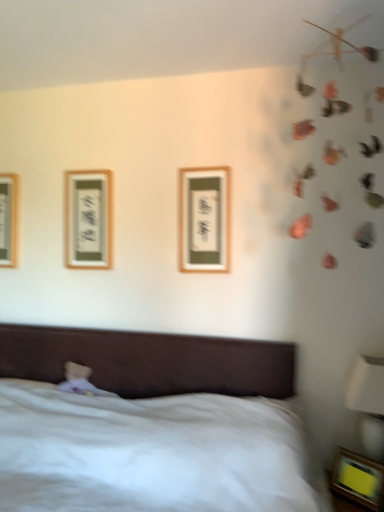
Question: Is wooden framed picture at left, which appears as the 1th picture frame when viewed from the left, to the right of wooden framed picture at center, which appears as the second picture frame when ordered from the bottom, from the viewer's perspective?

Choices:
 (A) yes
 (B) no

Answer: (B)

Question: Is wooden framed picture at left, the 4th picture frame in the front-to-back sequence, taller than wooden framed picture at center, positioned as the 3th picture frame in left-to-right order?

Choices:
 (A) no
 (B) yes

Answer: (B)

Question: Can you confirm if wooden framed picture at left, which appears as the 1th picture frame when viewed from the left, is positioned to the left of wooden framed picture at center, the 3th picture frame in the back-to-front sequence?

Choices:
 (A) yes
 (B) no

Answer: (A)

Question: Is wooden framed picture at left, marked as the fourth picture frame in a bottom-to-top arrangement, bigger than wooden framed picture at center, the third picture frame positioned from the top?

Choices:
 (A) no
 (B) yes

Answer: (A)

Question: Is wooden framed picture at left, marked as the fourth picture frame in a bottom-to-top arrangement, beside wooden framed picture at center, which is the second picture frame in right-to-left order?

Choices:
 (A) no
 (B) yes

Answer: (A)

Question: In the image, is wooden framed picture at center, which appears as the second picture frame when ordered from the bottom, positioned in front of or behind wooden framed picture at left, which appears as the 1th picture frame when viewed from the left?

Choices:
 (A) behind
 (B) front

Answer: (B)

Question: Is wooden framed picture at center, the 3th picture frame in the back-to-front sequence, inside the boundaries of wooden framed picture at left, the first picture frame in the top-to-bottom sequence, or outside?

Choices:
 (A) outside
 (B) inside

Answer: (A)

Question: From a real-world perspective, is wooden framed picture at center, the 3th picture frame in the back-to-front sequence, above or below wooden framed picture at left, the 4th picture frame in the front-to-back sequence?

Choices:
 (A) above
 (B) below

Answer: (B)

Question: Considering the positions of wooden framed picture at center, the third picture frame positioned from the top, and wooden framed picture at left, marked as the fourth picture frame in a bottom-to-top arrangement, in the image, is wooden framed picture at center, the third picture frame positioned from the top, taller or shorter than wooden framed picture at left, marked as the fourth picture frame in a bottom-to-top arrangement,?

Choices:
 (A) tall
 (B) short

Answer: (B)

Question: Considering the positions of wooden picture frame at lower right, marked as the 4th picture frame in a top-to-bottom arrangement, and white glossy bedside lamp at lower right in the image, is wooden picture frame at lower right, marked as the 4th picture frame in a top-to-bottom arrangement, wider or thinner than white glossy bedside lamp at lower right?

Choices:
 (A) thin
 (B) wide

Answer: (A)

Question: Is wooden picture frame at lower right, acting as the 1th picture frame starting from the bottom, to the left or to the right of white glossy bedside lamp at lower right in the image?

Choices:
 (A) left
 (B) right

Answer: (A)

Question: From the image's perspective, is wooden picture frame at lower right, arranged as the first picture frame when viewed from the right, positioned above or below white glossy bedside lamp at lower right?

Choices:
 (A) below
 (B) above

Answer: (A)

Question: From a real-world perspective, relative to white glossy bedside lamp at lower right, is wooden picture frame at lower right, arranged as the first picture frame when viewed from the right, vertically above or below?

Choices:
 (A) above
 (B) below

Answer: (B)

Question: From the image's perspective, is white plush bear at lower left positioned above or below wooden framed picture at left, the 4th picture frame in the front-to-back sequence?

Choices:
 (A) below
 (B) above

Answer: (A)

Question: From a real-world perspective, relative to wooden framed picture at left, which is the first picture frame in back-to-front order, is white plush bear at lower left vertically above or below?

Choices:
 (A) below
 (B) above

Answer: (A)